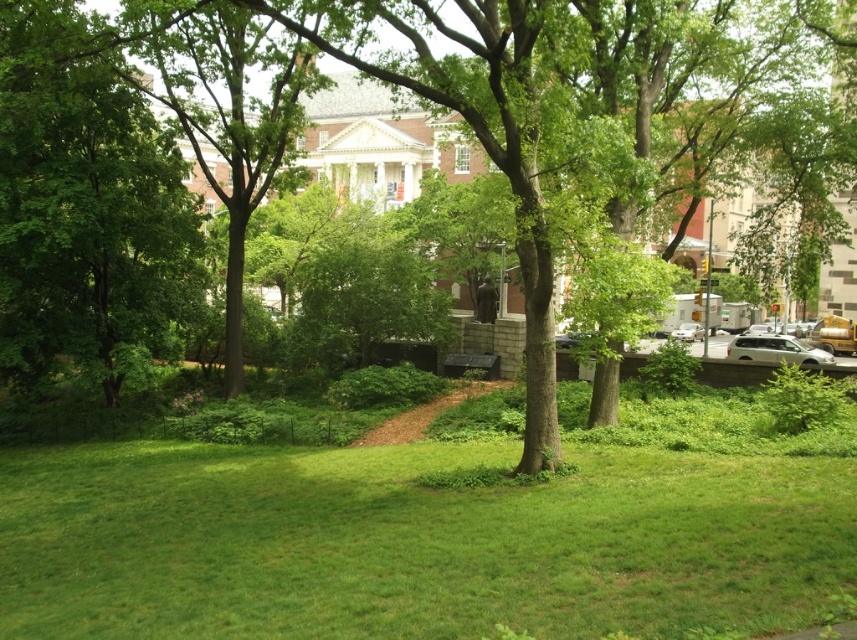
Question: Which object is positioned closest to the green leafy tree at center?

Choices:
 (A) silver metallic sedan at center-right
 (B) white matte car at right

Answer: (B)

Question: Does green leafy tree at center have a greater width compared to white matte car at right?

Choices:
 (A) yes
 (B) no

Answer: (A)

Question: Which point appears farthest from the camera in this image?

Choices:
 (A) (447, 29)
 (B) (693, 324)
 (C) (794, 360)

Answer: (B)

Question: Which point is farther from the camera taking this photo?

Choices:
 (A) (686, 340)
 (B) (163, 74)

Answer: (A)

Question: Considering the relative positions of green leafy tree at center and white matte car at right in the image provided, where is green leafy tree at center located with respect to white matte car at right?

Choices:
 (A) right
 (B) left

Answer: (B)

Question: Is green leafy tree at center positioned at the back of white matte car at right?

Choices:
 (A) no
 (B) yes

Answer: (A)